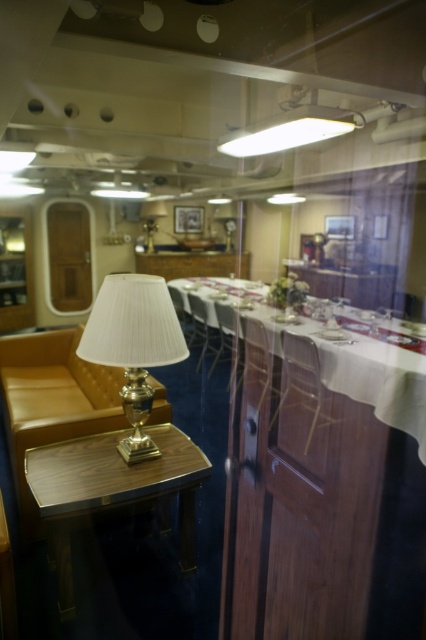
Question: Is woodenwoodentable at lower left positioned at the back of matte gold table lamp at center?

Choices:
 (A) no
 (B) yes

Answer: (A)

Question: Is wooden armchair at center below brown leather armchair at center?

Choices:
 (A) no
 (B) yes

Answer: (B)

Question: Does silver metallic table lamp at left appear on the left side of wooden chair at center?

Choices:
 (A) no
 (B) yes

Answer: (B)

Question: Estimate the real-world distances between objects in this image. Which object is closer to the wooden armchair at center?

Choices:
 (A) white matte fluorescent light at upper center
 (B) wooden chair at center
 (C) brown leather armchair at center
 (D) silver metallic table lamp at left

Answer: (B)

Question: Which of these objects is positioned farthest from the silver metallic table lamp at left?

Choices:
 (A) white matte fluorescent light at upper center
 (B) matte wood chair at center

Answer: (B)

Question: Which of the following is the closest to the observer?

Choices:
 (A) silver metallic table lamp at left
 (B) white cloth at center
 (C) woodenwoodentable at lower left
 (D) wooden chair at center

Answer: (C)